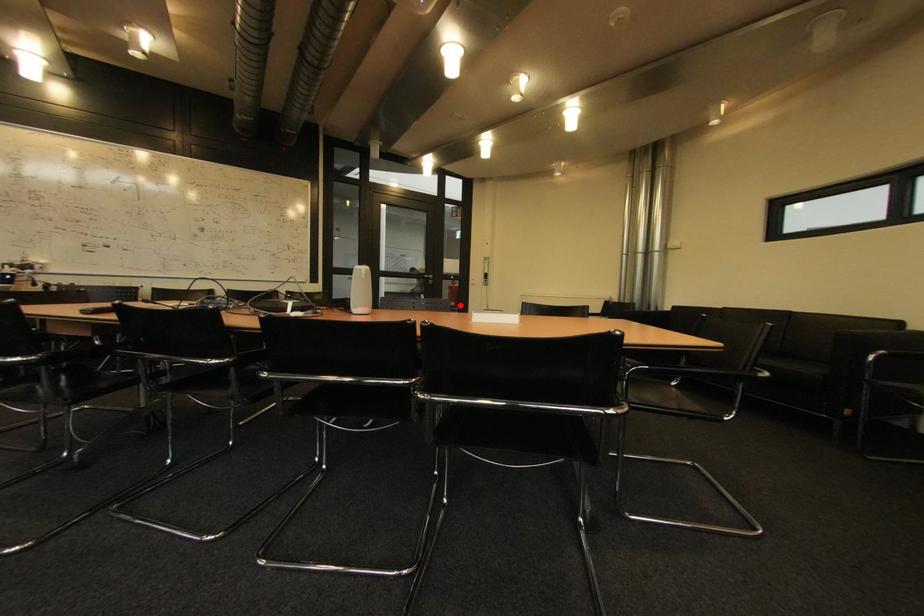
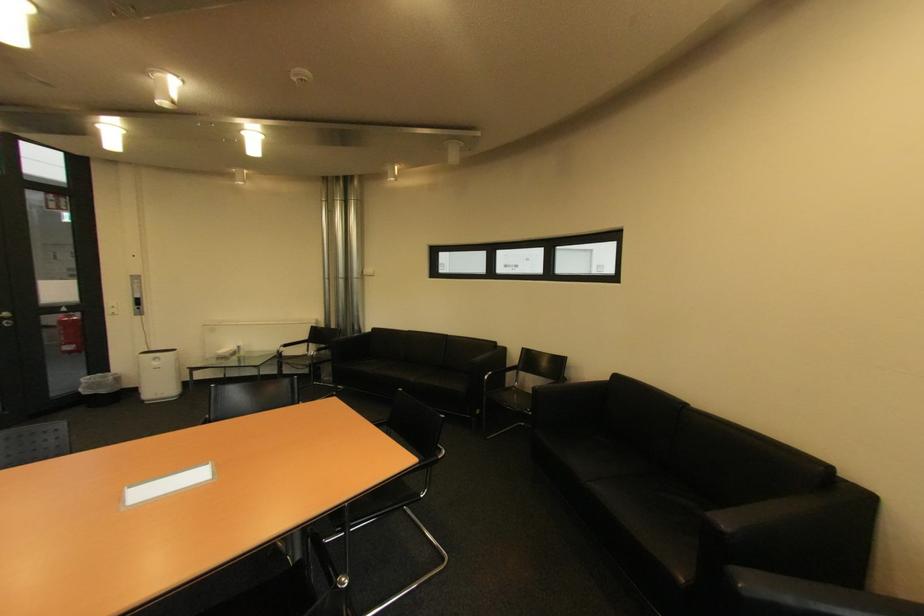
Find the pixel in the second image that matches the highlighted location in the first image.

(79, 349)